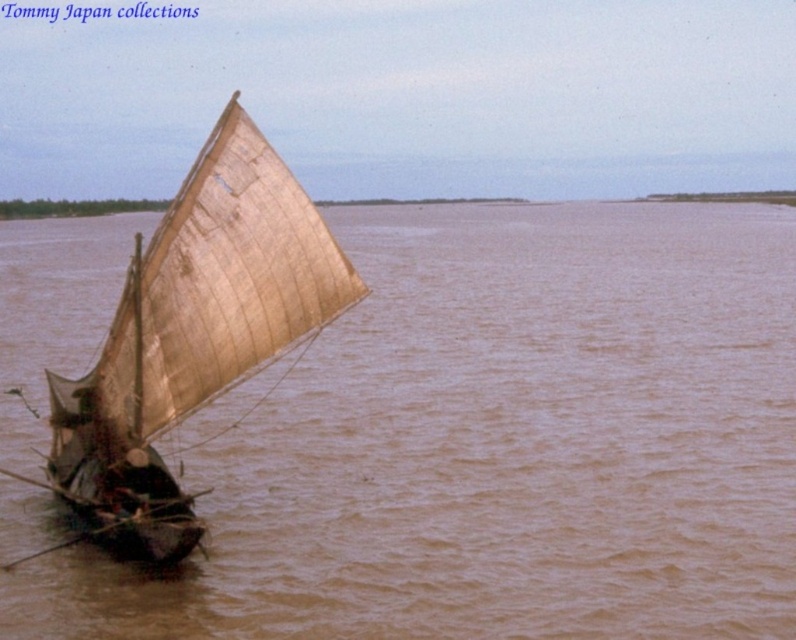
You are standing on the deck of the sailboat and want to move from the point at coordinates point (732, 288) to the point at coordinates point (92, 522). Which direction should you move to reach the destination?

Since point (732, 288) is behind point (92, 522), you should move forward to reach the destination.

You are a sailor navigating a traditional sailboat on a river. You need to avoid shallow areas to prevent grounding. The brown muddy water at center indicates deeper water. Is the deeper water located at point 0.697, 0.626?

Yes, the brown muddy water at center is located at point (498, 445), which indicates deeper water. Therefore, navigating towards that point would help avoid shallow areas and prevent grounding.

You are a sailor on the light brown canvas sailboat at left. You notice that the brown muddy water at center is wider than your boat. Can you safely navigate through the water without touching the sides?

The brown muddy water at center is wider than the light brown canvas sailboat at left, so yes, you can safely navigate through the water without touching the sides.